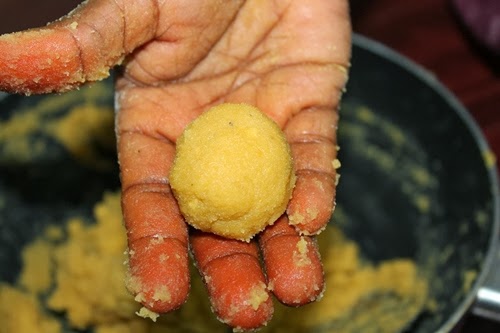
I want to click on pot handle, so click(x=490, y=298).